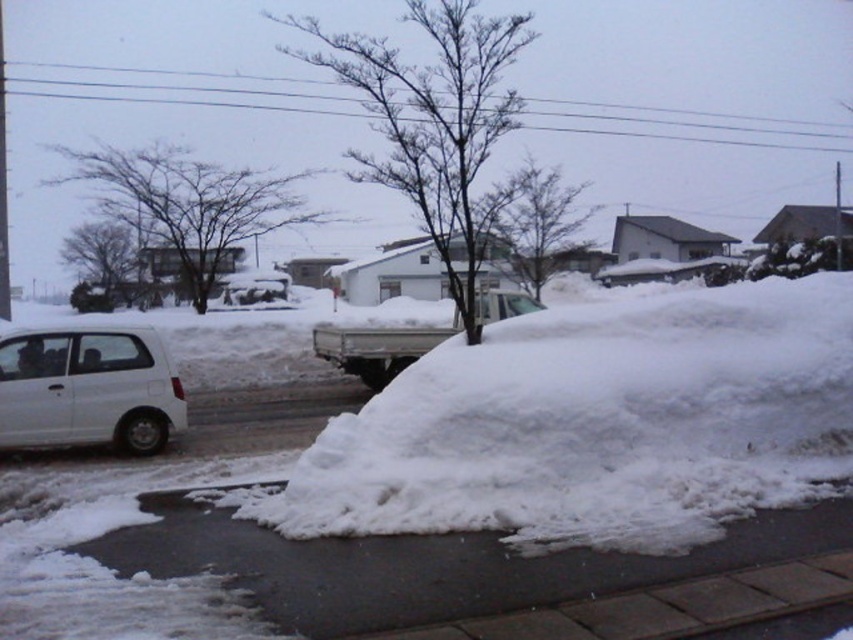
Consider the image. Is white fluffy snow at center shorter than white matte truck at center?

Correct, white fluffy snow at center is not as tall as white matte truck at center.

You are a GUI agent. You are given a task and a screenshot of the screen. Output one action in this format:
    pyautogui.click(x=<x>, y=<y>)
    Task: Click on the white fluffy snow at center
    The image size is (853, 640).
    Given the screenshot: What is the action you would take?
    pyautogui.click(x=596, y=424)

Between point (399, 413) and point (390, 339), which one is positioned in front?

Point (399, 413) is more forward.

Locate an element on the screen. white fluffy snow at center is located at coordinates (596, 424).

Which is above, white snow at lower center or white matte van at left?

Positioned higher is white matte van at left.

Who is more forward, [331,634] or [134,368]?

Positioned in front is point [331,634].

At what (x,y) coordinates should I click in order to perform the action: click on white snow at lower center. Please return your answer as a coordinate pair (x, y). Looking at the image, I should click on (480, 576).

Can you confirm if white fluffy snow at center is positioned below white snow at lower center?

No, white fluffy snow at center is not below white snow at lower center.

Between white fluffy snow at center and white snow at lower center, which one appears on the left side from the viewer's perspective?

From the viewer's perspective, white snow at lower center appears more on the left side.

Is point (474, 490) farther from camera compared to point (279, 582)?

That is True.

Image resolution: width=853 pixels, height=640 pixels. Identify the location of white fluffy snow at center. (596, 424).